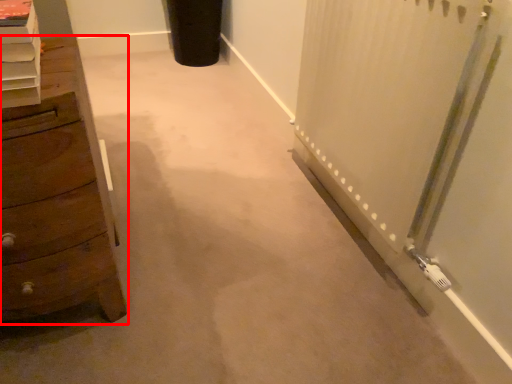
Question: In this image, where is chest of drawers (annotated by the red box) located relative to shelf?

Choices:
 (A) right
 (B) left

Answer: (B)